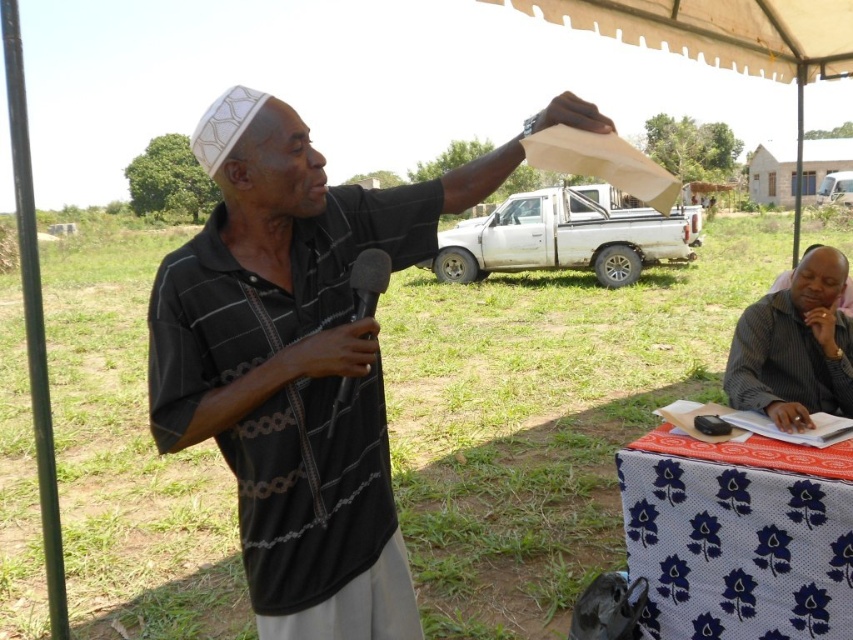
Question: Based on their relative distances, which object is farther from the matte black shirt at center?

Choices:
 (A) blue printed fabric table at lower right
 (B) black matte microphone at center
 (C) dark gray shirt at lower right

Answer: (C)

Question: From the image, what is the correct spatial relationship of matte black shirt at center in relation to black matte microphone at center?

Choices:
 (A) right
 (B) left

Answer: (B)

Question: Which point appears farthest from the camera in this image?

Choices:
 (A) (792, 273)
 (B) (683, 52)
 (C) (364, 307)
 (D) (834, 253)

Answer: (B)

Question: Does matte black shirt at center have a greater width compared to blue printed fabric table at lower right?

Choices:
 (A) no
 (B) yes

Answer: (B)

Question: Is matte black shirt at center positioned before dark gray shirt at lower right?

Choices:
 (A) no
 (B) yes

Answer: (B)

Question: Which object appears farthest from the camera in this image?

Choices:
 (A) white fabric canopy at upper center
 (B) black matte microphone at center

Answer: (A)